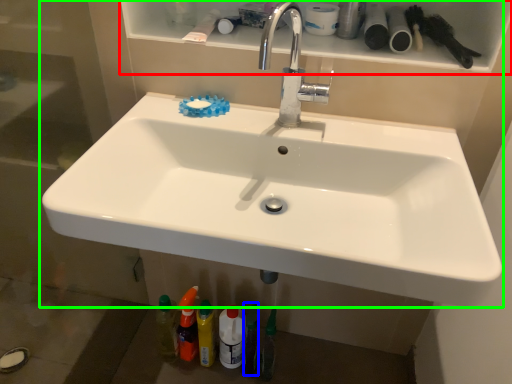
Question: Which object is positioned farthest from shelf (highlighted by a red box)? Select from toiletry (highlighted by a blue box) and sink (highlighted by a green box).

Choices:
 (A) toiletry
 (B) sink

Answer: (A)